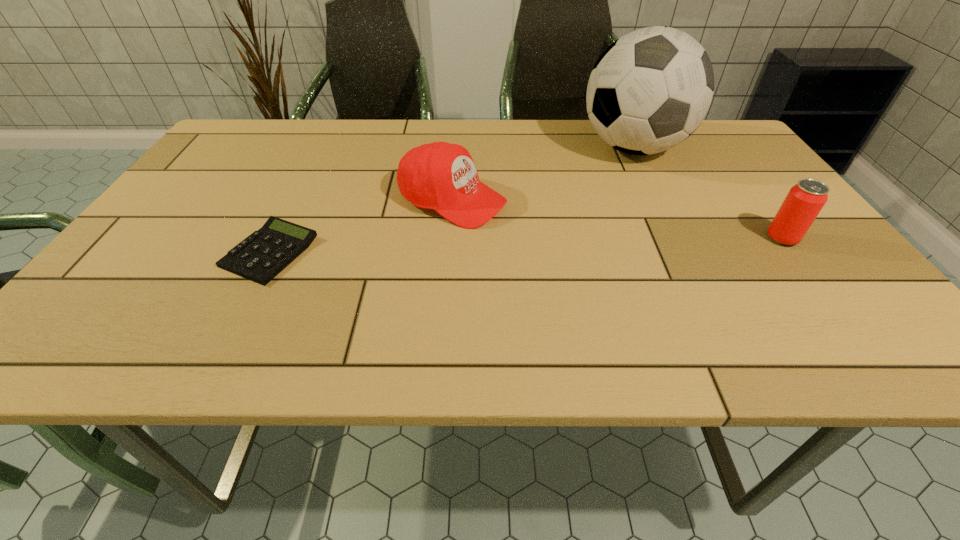
The width and height of the screenshot is (960, 540). Identify the location of vacant space that's between the rightmost object and the calculator. (526, 245).

Where is `empty space that is in between the second object from left to right and the soccer ball`? This screenshot has height=540, width=960. empty space that is in between the second object from left to right and the soccer ball is located at coordinates (542, 174).

Identify the location of vacant space in between the second object from right to left and the beer can. The image size is (960, 540). (708, 193).

The width and height of the screenshot is (960, 540). I want to click on unoccupied area between the shortest object and the rightmost object, so click(x=526, y=245).

This screenshot has height=540, width=960. I want to click on blank region between the baseball cap and the soccer ball, so click(x=542, y=174).

Image resolution: width=960 pixels, height=540 pixels. I want to click on object that is the third closest to the soccer ball, so click(x=260, y=257).

You are a GUI agent. You are given a task and a screenshot of the screen. Output one action in this format:
    pyautogui.click(x=<x>, y=<y>)
    Task: Click on the object that stands as the third closest to the second object from left to right
    
    Given the screenshot: What is the action you would take?
    804,201

This screenshot has height=540, width=960. Find the location of `vacant region that satisfies the following two spatial constraints: 1. on the front side of the rightmost object; 2. on the left side of the baseball cap`. vacant region that satisfies the following two spatial constraints: 1. on the front side of the rightmost object; 2. on the left side of the baseball cap is located at coordinates (449, 238).

The width and height of the screenshot is (960, 540). I want to click on free space that satisfies the following two spatial constraints: 1. on the front side of the baseball cap; 2. on the left side of the beer can, so click(x=449, y=238).

You are a GUI agent. You are given a task and a screenshot of the screen. Output one action in this format:
    pyautogui.click(x=<x>, y=<y>)
    Task: Click on the vacant space that satisfies the following two spatial constraints: 1. on the front side of the baseball cap; 2. on the right side of the beer can
    This screenshot has height=540, width=960.
    Given the screenshot: What is the action you would take?
    pyautogui.click(x=449, y=238)